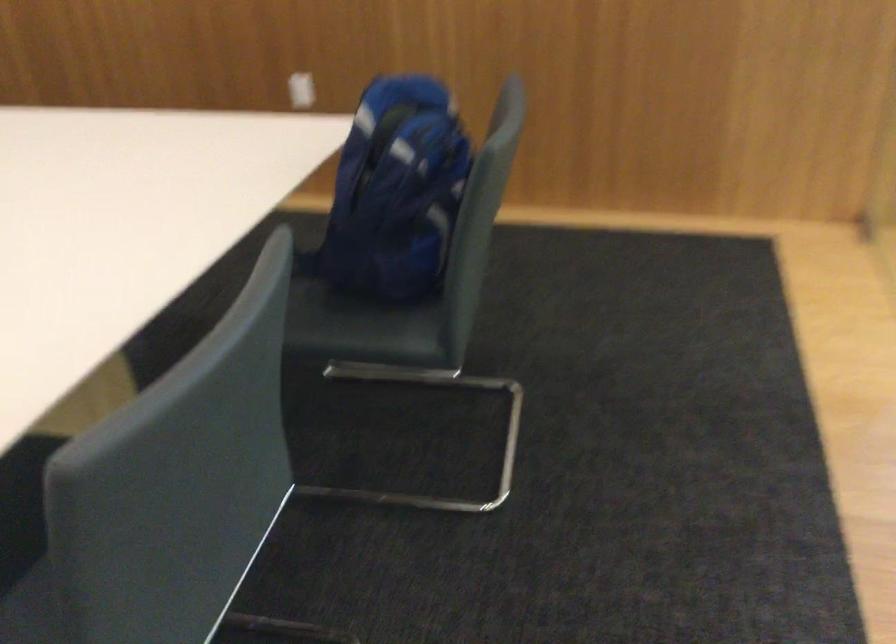
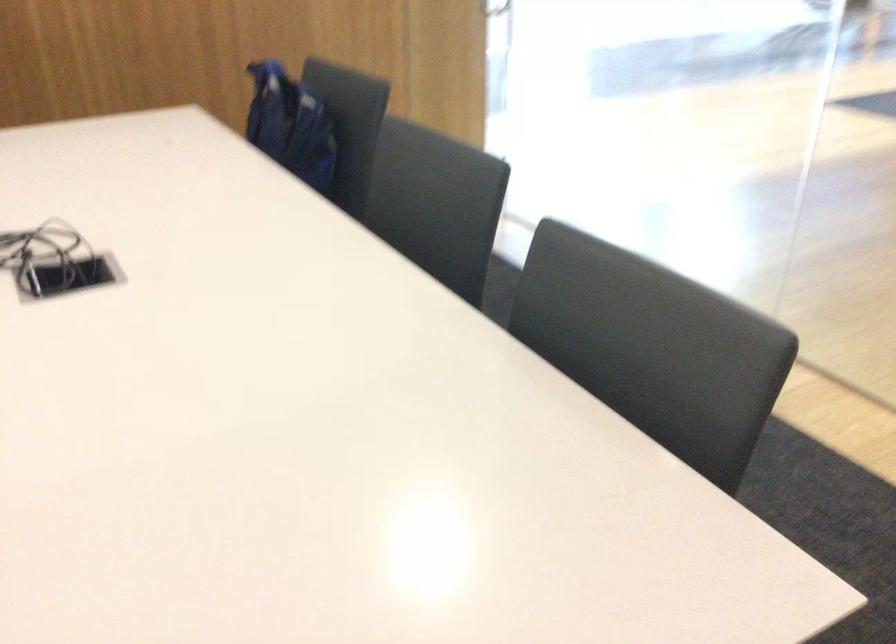
Where in the second image is the point corresponding to (x=382, y=178) from the first image?

(289, 125)